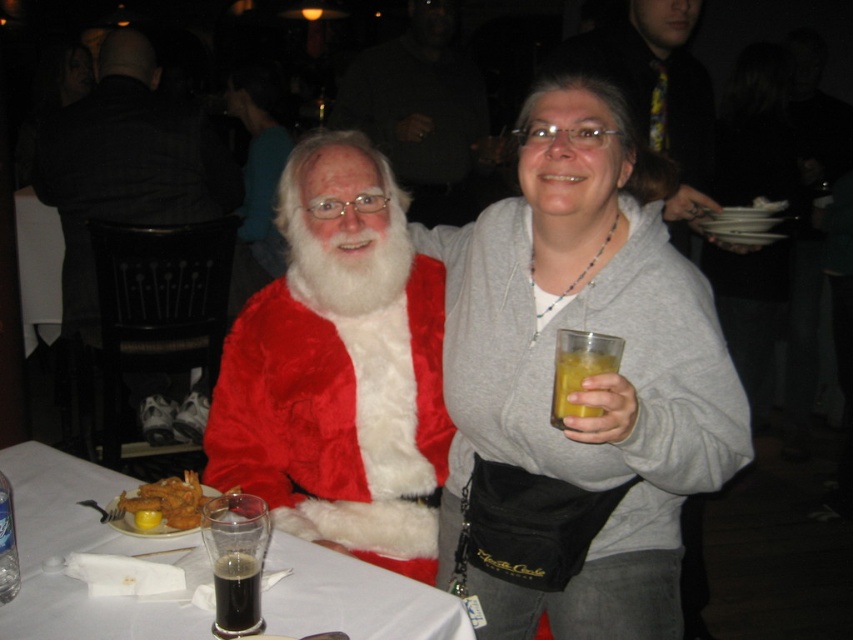
From the picture: Can you confirm if white paper napkin at lower left is positioned to the left of dark glass beer at table center?

Indeed, white paper napkin at lower left is positioned on the left side of dark glass beer at table center.

The height and width of the screenshot is (640, 853). What do you see at coordinates (79, 550) in the screenshot?
I see `white paper napkin at lower left` at bounding box center [79, 550].

At what (x,y) coordinates should I click in order to perform the action: click on white paper napkin at lower left. Please return your answer as a coordinate pair (x, y). Looking at the image, I should click on (79, 550).

Can you confirm if fuzzy red santa at center is thinner than fuzzy red coat at center?

A: Correct, fuzzy red santa at center's width is less than fuzzy red coat at center's.

How far apart are fuzzy red santa at center and fuzzy red coat at center?

4.48 feet

At what (x,y) coordinates should I click in order to perform the action: click on fuzzy red santa at center. Please return your answer as a coordinate pair (x, y). The height and width of the screenshot is (640, 853). Looking at the image, I should click on (339, 372).

You are a GUI agent. You are given a task and a screenshot of the screen. Output one action in this format:
    pyautogui.click(x=<x>, y=<y>)
    Task: Click on the fuzzy red santa at center
    This screenshot has width=853, height=640.
    Given the screenshot: What is the action you would take?
    pyautogui.click(x=339, y=372)

The width and height of the screenshot is (853, 640). Describe the element at coordinates (235, 561) in the screenshot. I see `dark glass beer at table center` at that location.

Describe the element at coordinates (235, 561) in the screenshot. I see `dark glass beer at table center` at that location.

This screenshot has height=640, width=853. Find the location of `dark glass beer at table center`. dark glass beer at table center is located at coordinates (235, 561).